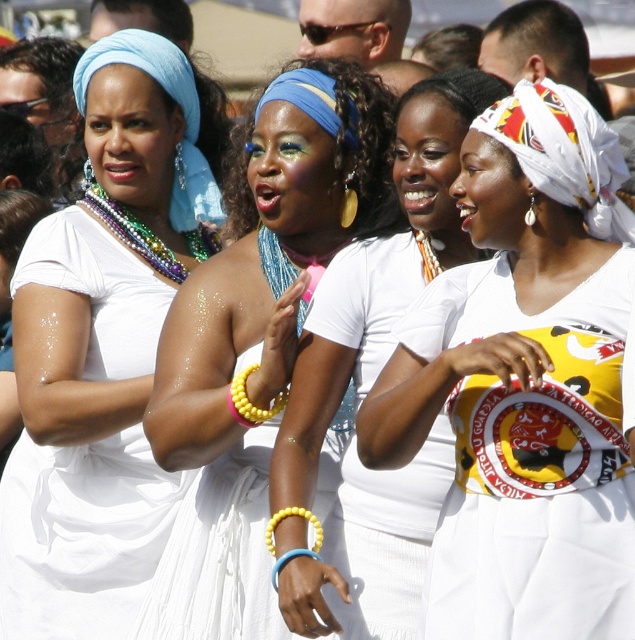
Who is lower down, matte white dress at center or blue fabric headscarf at upper left?

matte white dress at center is lower down.

Measure the distance between point (60, 538) and camera.

Point (60, 538) and camera are 33.78 meters apart from each other.

You are a GUI agent. You are given a task and a screenshot of the screen. Output one action in this format:
    pyautogui.click(x=<x>, y=<y>)
    Task: Click on the matte white dress at center
    
    Given the screenshot: What is the action you would take?
    pyautogui.click(x=104, y=340)

Is matte white dress at center below white woven headscarf at upper right?

Indeed, matte white dress at center is positioned under white woven headscarf at upper right.

Which is above, matte white dress at center or white woven headscarf at upper right?

white woven headscarf at upper right

Locate an element on the screen. matte white dress at center is located at coordinates (104, 340).

Is the position of yellow beaded bracelet at center more distant than that of yellow rubber bracelet at center?

Yes, it is behind yellow rubber bracelet at center.

Does yellow beaded bracelet at center have a lesser width compared to yellow rubber bracelet at center?

No, yellow beaded bracelet at center is not thinner than yellow rubber bracelet at center.

Which is in front, point (281, 392) or point (272, 540)?

Point (272, 540) is more forward.

Where is `yellow beaded bracelet at center`? yellow beaded bracelet at center is located at coordinates (250, 403).